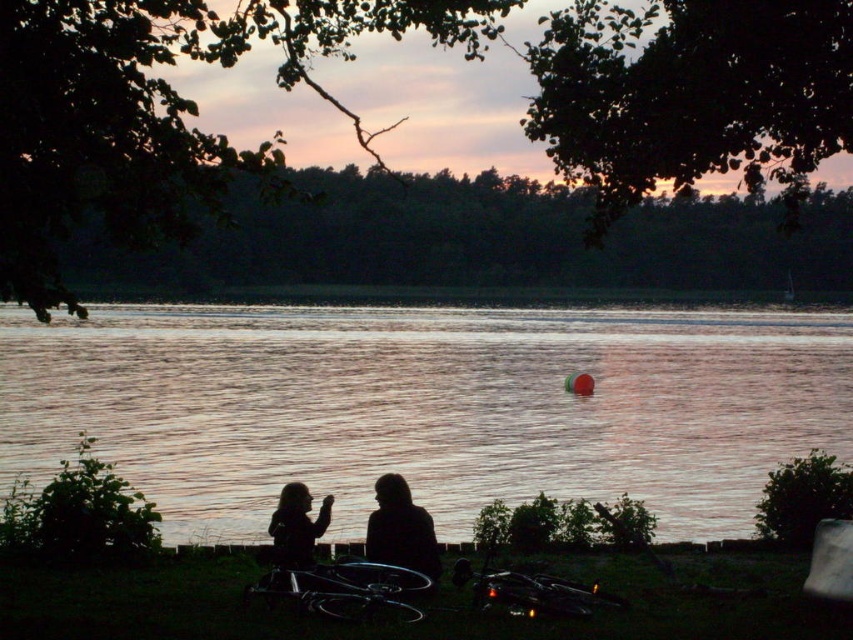
Question: Which point is farther from the camera taking this photo?

Choices:
 (A) (421, 557)
 (B) (277, 504)
 (C) (329, 500)

Answer: (B)

Question: Can you confirm if silhouette fabric couple at lower center is positioned above silhouette fabric person at center?

Choices:
 (A) no
 (B) yes

Answer: (B)

Question: Which point is closer to the camera?

Choices:
 (A) silhouette fabric couple at lower center
 (B) silhouette figure at center
 (C) reflective water at center

Answer: (B)

Question: Which object appears farthest from the camera in this image?

Choices:
 (A) reflective water at center
 (B) silhouette figure at center
 (C) silhouette fabric person at center

Answer: (A)

Question: Can you confirm if reflective water at center is bigger than silhouette fabric couple at lower center?

Choices:
 (A) yes
 (B) no

Answer: (A)

Question: Does reflective water at center have a greater width compared to silhouette fabric couple at lower center?

Choices:
 (A) no
 (B) yes

Answer: (B)